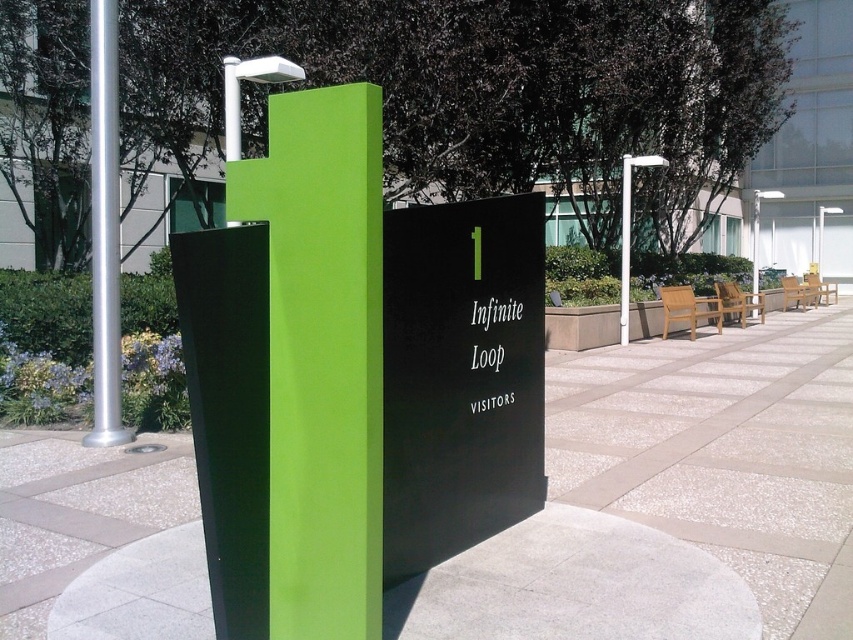
In the scene shown: You are a maintenance worker who needs to attach a new plaque to the narrower object between the lime green matte pillar at center and the white plastic pole at center. Which object should you choose?

The lime green matte pillar at center is narrower than the white plastic pole at center, so you should attach the plaque to the lime green matte pillar at center.

You are standing at the entrance of the corporate campus and need to locate the visitor registration desk. You see a lime green matte pillar at center and a silver metallic pole at left. According to the spatial arrangement, which object is positioned lower in the scene?

The lime green matte pillar at center is positioned lower than the silver metallic pole at left in the scene.

You are a maintenance worker needing to replace a pole with a wider base. You see the silver metallic pole at left and the white plastic pole at center. Which pole should you choose for replacement?

The white plastic pole at center has a greater width compared to the silver metallic pole at left, so you should choose the white plastic pole at center for replacement since it has a wider base.